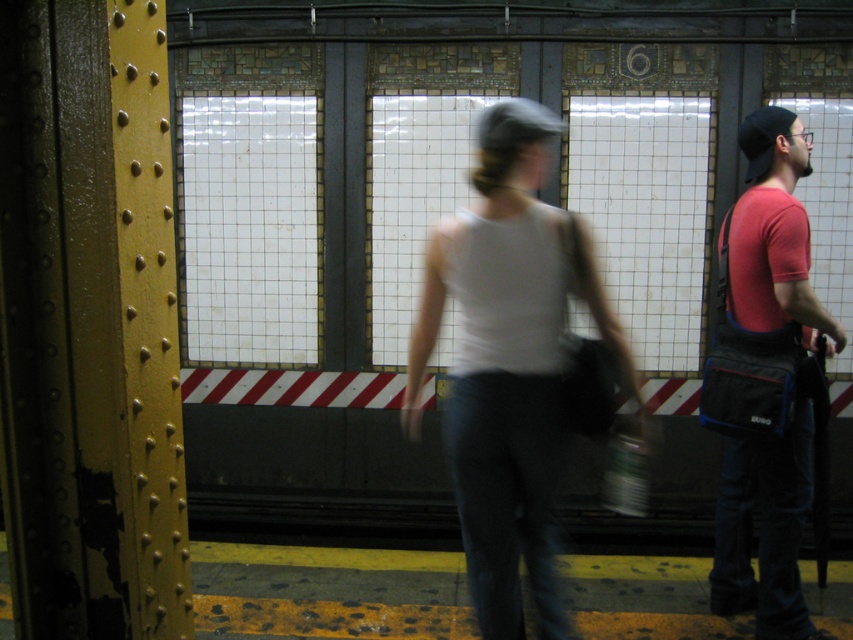
You are standing at the entrance of the subway station and want to locate the person wearing the white matte tank top at center. According to the coordinates provided, where should you look relative to the tiled wall?

The white matte tank top at center is located at coordinates point (x=509, y=362) relative to the tiled wall, so you should look approximately at that position to find the person.

You are a delivery robot in a subway station. You need to move from your current position to pick up the red fabric bag at right. There is a person wearing a white matte tank top at center walking towards the tracks. Can you safely navigate around them to reach the bag without getting too close?

The distance between the white matte tank top at center and the red fabric bag at right is 31.23 inches. Since the robot needs to maintain a safe distance from the person, it can navigate around them as long as it stays more than 31.23 inches away to avoid collision.